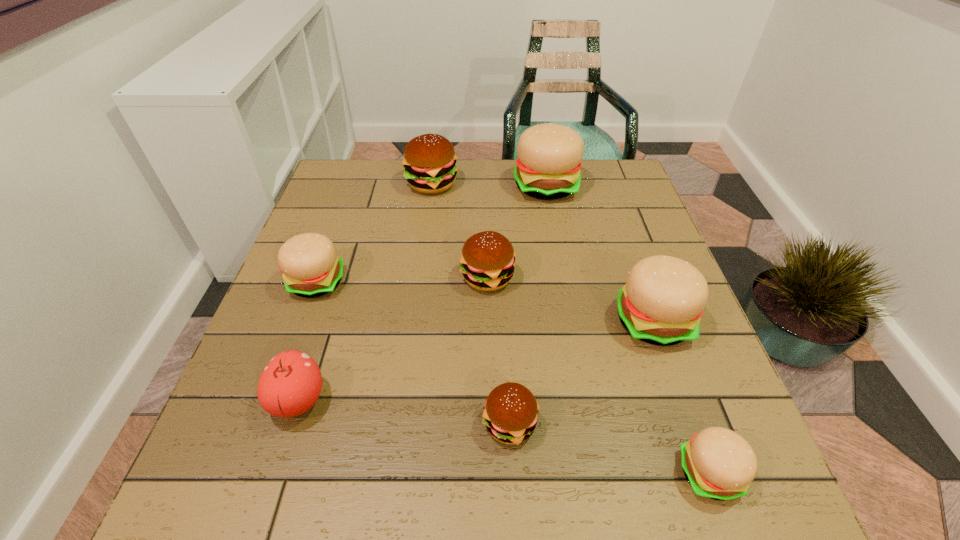
The height and width of the screenshot is (540, 960). What are the coordinates of `unoccupied position between the sixth object from right to left and the smallest beige hamburger` in the screenshot? It's located at (570, 328).

The width and height of the screenshot is (960, 540). I want to click on vacant space in between the smallest brown hamburger and the second biggest beige hamburger, so click(581, 372).

Image resolution: width=960 pixels, height=540 pixels. I want to click on free space between the smallest brown hamburger and the third smallest beige hamburger, so click(581, 372).

Identify the location of free space between the nearest brown hamburger and the third biggest beige hamburger. (413, 353).

Locate an element on the screen. blank region between the smallest beige hamburger and the second farthest brown hamburger is located at coordinates (599, 375).

This screenshot has height=540, width=960. I want to click on free space between the second nearest brown hamburger and the biggest brown hamburger, so click(x=460, y=231).

The width and height of the screenshot is (960, 540). I want to click on blank region between the leftmost beige hamburger and the red apple, so click(x=307, y=341).

Point out which object is positioned as the fourth nearest to the nearest beige hamburger. Please provide its 2D coordinates. Your answer should be formatted as a tuple, i.e. [(x, y)], where the tuple contains the x and y coordinates of a point satisfying the conditions above.

[(290, 384)]

The height and width of the screenshot is (540, 960). What are the coordinates of `object that is the fifth nearest to the third smallest beige hamburger` in the screenshot? It's located at (429, 160).

Select which hamburger is the sixth closest to the leftmost hamburger. Please provide its 2D coordinates. Your answer should be formatted as a tuple, i.e. [(x, y)], where the tuple contains the x and y coordinates of a point satisfying the conditions above.

[(720, 464)]